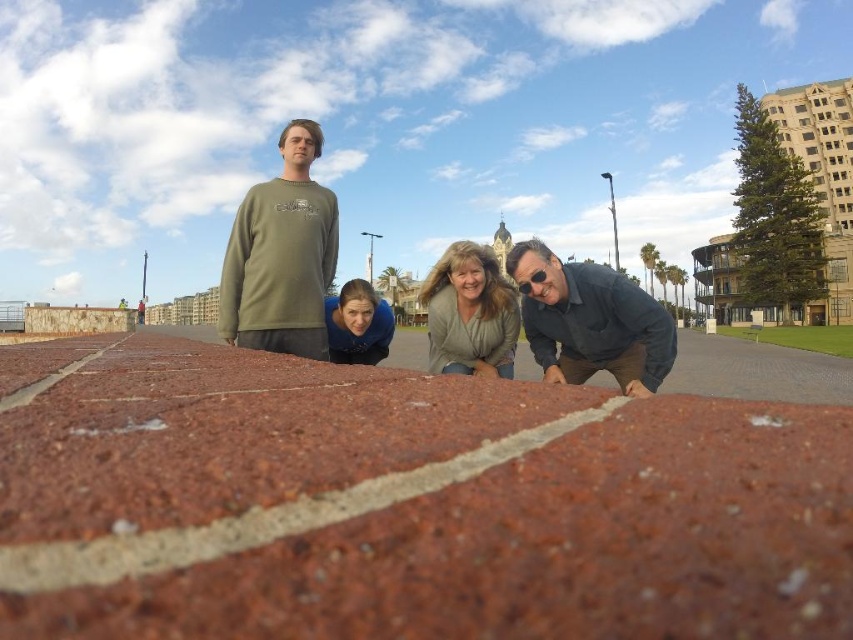
Question: Does olive green sweatshirt at upper left have a greater width compared to light brown sweater at center?

Choices:
 (A) no
 (B) yes

Answer: (B)

Question: Can you confirm if green cotton shirt at center is positioned to the left of brick pavement at center?

Choices:
 (A) no
 (B) yes

Answer: (B)

Question: Which point is farther to the camera?

Choices:
 (A) light brown sweater at center
 (B) blue fabric shirt at center

Answer: (B)

Question: Observing the image, what is the correct spatial positioning of brick pavement at center in reference to blue fabric shirt at center?

Choices:
 (A) right
 (B) left

Answer: (A)

Question: Estimate the real-world distances between objects in this image. Which object is farther from the blue fabric shirt at center?

Choices:
 (A) dark gray shirt at lower right
 (B) brick pavement at center

Answer: (B)

Question: Which point is closer to the camera?

Choices:
 (A) (665, 337)
 (B) (706, 381)
 (C) (525, 296)
 (D) (364, 310)

Answer: (A)